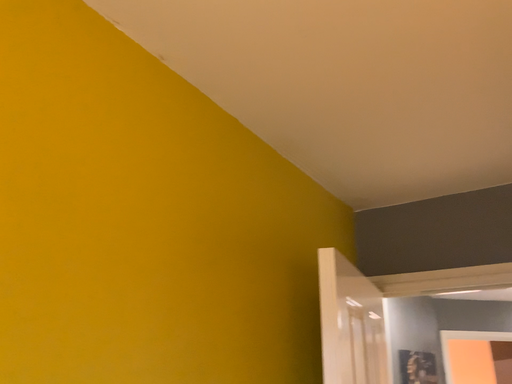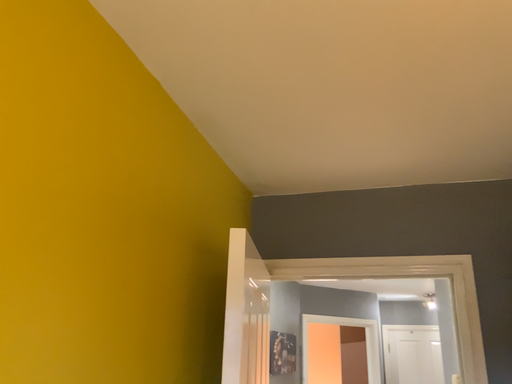
Question: How did the camera likely rotate when shooting the video?

Choices:
 (A) rotated right
 (B) rotated left

Answer: (A)